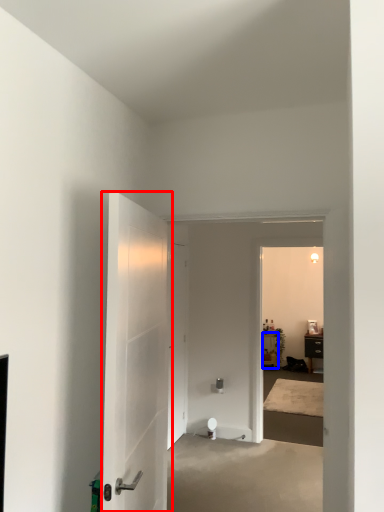
Question: Which object is further to the camera taking this photo, door (highlighted by a red box) or furniture (highlighted by a blue box)?

Choices:
 (A) door
 (B) furniture

Answer: (B)